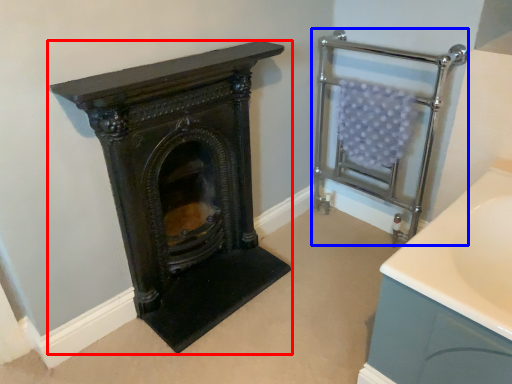
Question: Among these objects, which one is nearest to the camera, wood burning stove (highlighted by a red box) or balustrade (highlighted by a blue box)?

Choices:
 (A) wood burning stove
 (B) balustrade

Answer: (A)